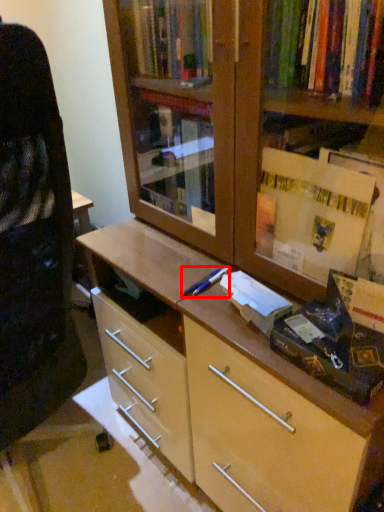
Question: From the image's perspective, where is pen (annotated by the red box) located in relation to book in the image?

Choices:
 (A) above
 (B) below

Answer: (A)